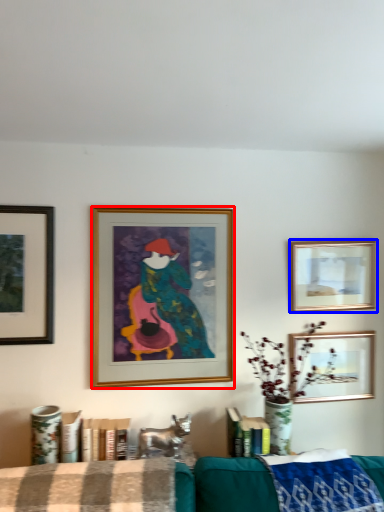
Question: Which of the following is the farthest to the observer, picture frame (highlighted by a red box) or picture frame (highlighted by a blue box)?

Choices:
 (A) picture frame
 (B) picture frame

Answer: (B)